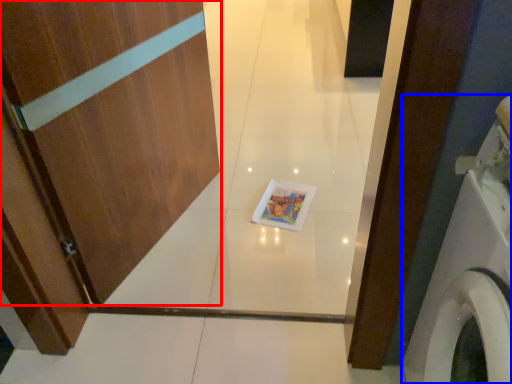
Question: Which point is further to the camera, door (highlighted by a red box) or washing machine (highlighted by a blue box)?

Choices:
 (A) door
 (B) washing machine

Answer: (A)